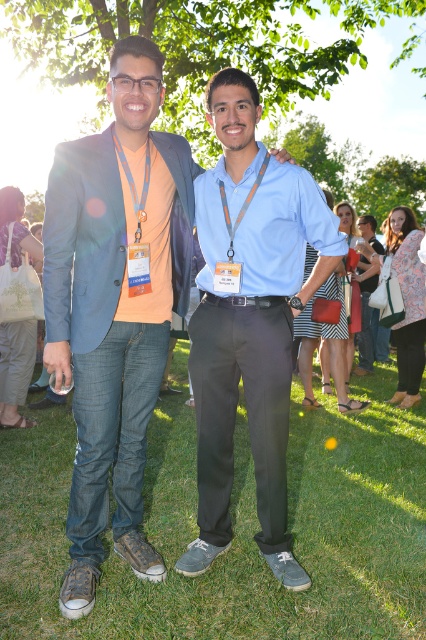
Question: Which point is farther to the camera?

Choices:
 (A) blue fabric lanyard at left
 (B) green grass at lower center

Answer: (A)

Question: Does matte blue blazer at center lie in front of orange fabric lanyard at center?

Choices:
 (A) yes
 (B) no

Answer: (A)

Question: Is matte blue blazer at center to the left of orange fabric lanyard at center from the viewer's perspective?

Choices:
 (A) yes
 (B) no

Answer: (A)

Question: Can you confirm if light blue shirt at center is smaller than blue fabric lanyard at left?

Choices:
 (A) yes
 (B) no

Answer: (B)

Question: Based on their relative distances, which object is nearer to the blue fabric lanyard at left?

Choices:
 (A) green grass at lower center
 (B) orange fabric lanyard at center
 (C) matte blue blazer at center

Answer: (B)

Question: Which is nearer to the light blue shirt at center?

Choices:
 (A) green grass at lower center
 (B) orange fabric lanyard at center
 (C) blue fabric lanyard at left
 (D) matte blue blazer at center

Answer: (D)